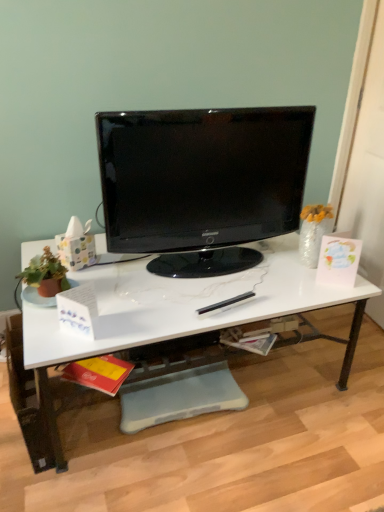
Question: Is white marble desk at center closer to camera compared to black glossy monitor at center?

Choices:
 (A) yes
 (B) no

Answer: (A)

Question: Is white marble desk at center surrounding black glossy monitor at center?

Choices:
 (A) no
 (B) yes

Answer: (A)

Question: From a real-world perspective, is white marble desk at center positioned under black glossy monitor at center based on gravity?

Choices:
 (A) no
 (B) yes

Answer: (B)

Question: Is white marble desk at center positioned with its back to black glossy monitor at center?

Choices:
 (A) no
 (B) yes

Answer: (A)

Question: Is white marble desk at center shorter than black glossy monitor at center?

Choices:
 (A) no
 (B) yes

Answer: (B)

Question: Can you confirm if white marble desk at center is positioned to the left of black glossy monitor at center?

Choices:
 (A) yes
 (B) no

Answer: (A)

Question: Can you confirm if black glossy monitor at center is taller than white marble desk at center?

Choices:
 (A) no
 (B) yes

Answer: (B)

Question: Is black glossy monitor at center facing towards white marble desk at center?

Choices:
 (A) no
 (B) yes

Answer: (A)

Question: Are black glossy monitor at center and white marble desk at center making contact?

Choices:
 (A) yes
 (B) no

Answer: (B)

Question: Is black glossy monitor at center far away from white marble desk at center?

Choices:
 (A) no
 (B) yes

Answer: (A)

Question: Considering the relative sizes of black glossy monitor at center and white marble desk at center in the image provided, is black glossy monitor at center bigger than white marble desk at center?

Choices:
 (A) no
 (B) yes

Answer: (A)

Question: From a real-world perspective, is black glossy monitor at center under white marble desk at center?

Choices:
 (A) yes
 (B) no

Answer: (B)

Question: Considering the positions of point (301, 283) and point (130, 183), is point (301, 283) closer or farther from the camera than point (130, 183)?

Choices:
 (A) closer
 (B) farther

Answer: (B)